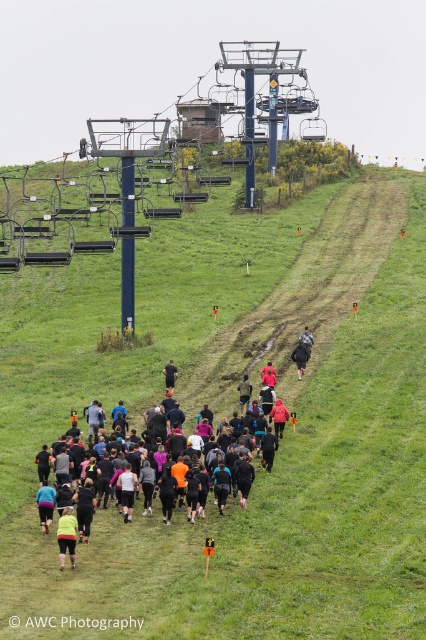
Is orange fabric jacket at center closer to the viewer compared to camouflage fabric jacket at center?

Yes, it is.

Who is more distant from viewer, (271,413) or (305,326)?

Positioned behind is point (305,326).

Identify the location of orange fabric jacket at center. (279, 417).

Who is taller, orange fabric jacket at center or black matte jacket at center?

Standing taller between the two is orange fabric jacket at center.

Does orange fabric jacket at center have a greater width compared to black matte jacket at center?

Incorrect, orange fabric jacket at center's width does not surpass black matte jacket at center's.

What do you see at coordinates (279, 417) in the screenshot? The width and height of the screenshot is (426, 640). I see `orange fabric jacket at center` at bounding box center [279, 417].

Where is `orange fabric jacket at center`? The width and height of the screenshot is (426, 640). orange fabric jacket at center is located at coordinates (279, 417).

Can you confirm if yellow fabric shorts at lower left is shorter than black matte jacket at center?

No.

Which is below, yellow fabric shorts at lower left or black matte jacket at center?

yellow fabric shorts at lower left

Find the location of `yellow fabric shorts at lower left`. yellow fabric shorts at lower left is located at coordinates (66, 536).

This screenshot has height=640, width=426. What are the coordinates of `yellow fabric shorts at lower left` in the screenshot? It's located at (66, 536).